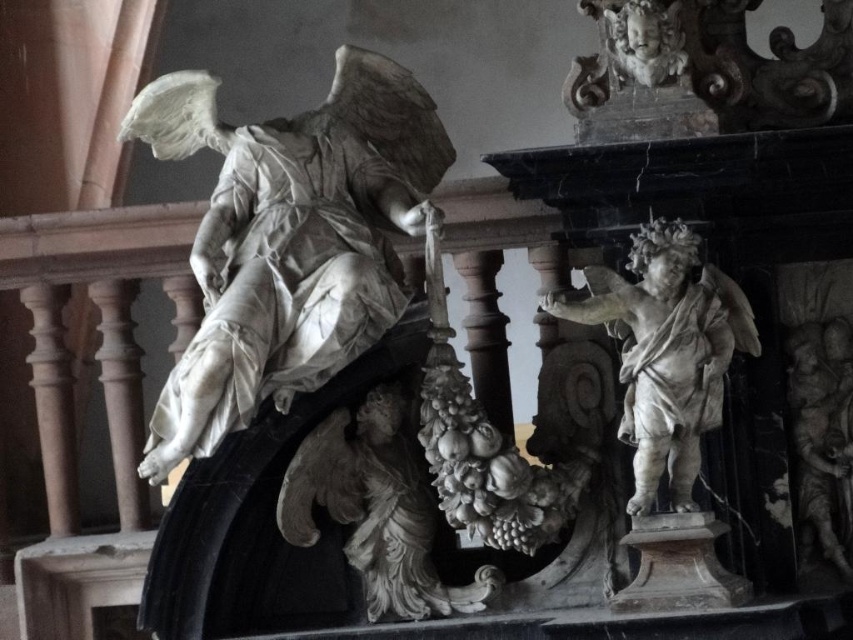
Question: Considering the real-world distances, which object is closest to the white marble angel at left?

Choices:
 (A) white marble cherub at center
 (B) white marble grapes at center
 (C) white marble cherub at upper right

Answer: (B)

Question: Which of the following is the closest to the observer?

Choices:
 (A) white marble cherub at center
 (B) white marble cherub at upper right
 (C) smooth gray cherub at right
 (D) white marble angel at left

Answer: (A)

Question: Can you confirm if white marble angel at left is positioned to the right of white marble cherub at center?

Choices:
 (A) yes
 (B) no

Answer: (B)

Question: Can you confirm if white marble cherub at center is positioned below white marble grapes at center?

Choices:
 (A) no
 (B) yes

Answer: (A)

Question: Does white marble grapes at center appear on the right side of white marble cherub at upper right?

Choices:
 (A) yes
 (B) no

Answer: (B)

Question: Which object appears closest to the camera in this image?

Choices:
 (A) white marble cherub at center
 (B) smooth gray cherub at right

Answer: (A)